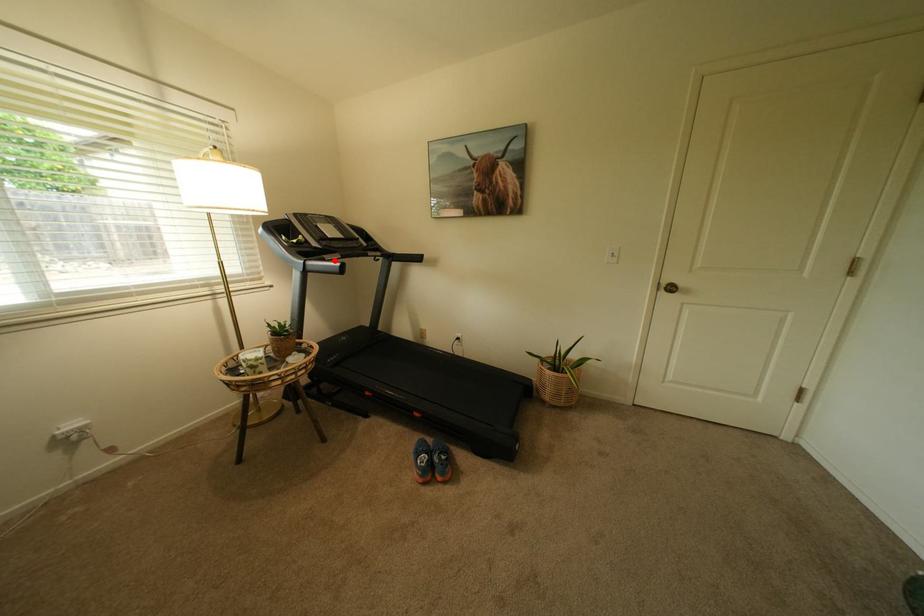
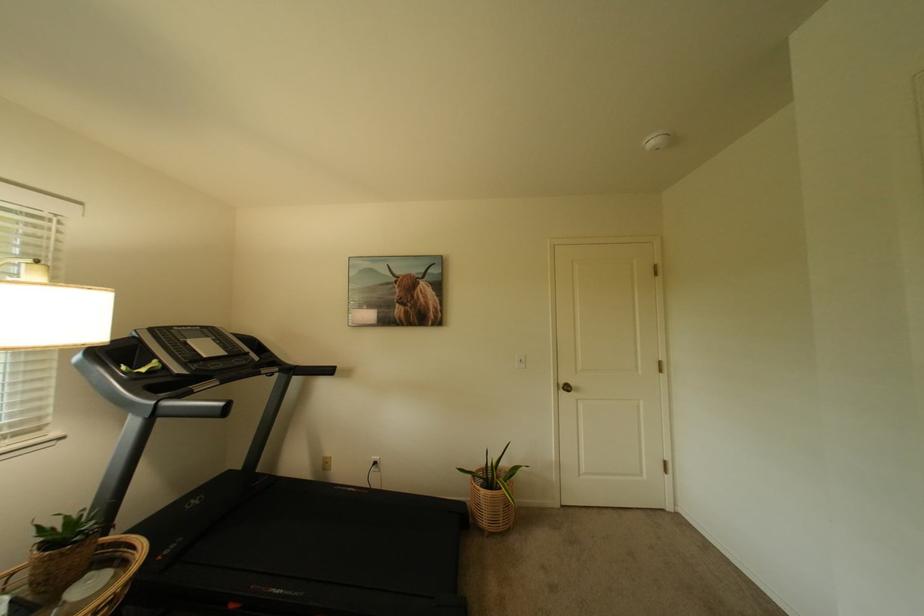
Find the pixel in the second image that matches the highlighted location in the first image.

(203, 392)